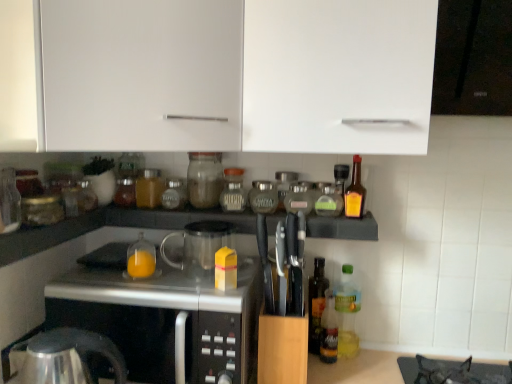
Question: Is amber glass bottle at right, which appears as the 1th bottle when viewed from the right, shorter than green glass bottle at center, placed as the 9th bottle when sorted from left to right?

Choices:
 (A) no
 (B) yes

Answer: (A)

Question: Is amber glass bottle at right, which appears as the 1th bottle when viewed from the right, behind green glass bottle at center, placed as the 9th bottle when sorted from left to right?

Choices:
 (A) yes
 (B) no

Answer: (B)

Question: Is amber glass bottle at right, which appears as the 1th bottle when viewed from the right, positioned in front of green glass bottle at center, the 4th bottle from the right?

Choices:
 (A) no
 (B) yes

Answer: (B)

Question: Is green glass bottle at center, the 4th bottle from the right, surrounded by amber glass bottle at right, which appears as the 1th bottle when viewed from the right?

Choices:
 (A) yes
 (B) no

Answer: (B)

Question: Considering the relative sizes of amber glass bottle at right, arranged as the twelfth bottle when viewed from the left, and green glass bottle at center, the 4th bottle from the right, in the image provided, is amber glass bottle at right, arranged as the twelfth bottle when viewed from the left, smaller than green glass bottle at center, the 4th bottle from the right,?

Choices:
 (A) yes
 (B) no

Answer: (B)

Question: In the image, is white matte cabinet at upper center, placed as the 1th cabinetry when sorted from right to left, positioned in front of or behind clear plastic bottle at lower right, placed as the 11th bottle when sorted from left to right?

Choices:
 (A) behind
 (B) front

Answer: (B)

Question: Is point (284, 77) positioned closer to the camera than point (347, 327)?

Choices:
 (A) farther
 (B) closer

Answer: (B)

Question: From the image's perspective, is white matte cabinet at upper center, the 3th cabinetry in the left-to-right sequence, positioned above or below clear plastic bottle at lower right, the 2th bottle viewed from the right?

Choices:
 (A) below
 (B) above

Answer: (B)

Question: Is white matte cabinet at upper center, the 3th cabinetry in the left-to-right sequence, wider or thinner than clear plastic bottle at lower right, placed as the 11th bottle when sorted from left to right?

Choices:
 (A) wide
 (B) thin

Answer: (A)

Question: From the image's perspective, is brown glass jar at center, the tenth bottle positioned from the right, above or below white matte cabinet at upper center, which ranks as the 1th cabinetry in left-to-right order?

Choices:
 (A) below
 (B) above

Answer: (A)

Question: Is brown glass jar at center, the tenth bottle positioned from the right, inside the boundaries of white matte cabinet at upper center, which is counted as the third cabinetry, starting from the right, or outside?

Choices:
 (A) inside
 (B) outside

Answer: (B)

Question: In the image, is brown glass jar at center, the tenth bottle positioned from the right, positioned in front of or behind white matte cabinet at upper center, which is counted as the third cabinetry, starting from the right?

Choices:
 (A) front
 (B) behind

Answer: (B)

Question: Looking at their shapes, would you say brown glass jar at center, which is the 3th bottle from left to right, is wider or thinner than white matte cabinet at upper center, which is counted as the third cabinetry, starting from the right?

Choices:
 (A) wide
 (B) thin

Answer: (B)

Question: Is green glass bottle at center, the 4th bottle from the right, wider or thinner than brown glass jar at center, the tenth bottle positioned from the right?

Choices:
 (A) wide
 (B) thin

Answer: (B)

Question: In terms of size, does green glass bottle at center, the 4th bottle from the right, appear bigger or smaller than brown glass jar at center, the tenth bottle positioned from the right?

Choices:
 (A) small
 (B) big

Answer: (B)